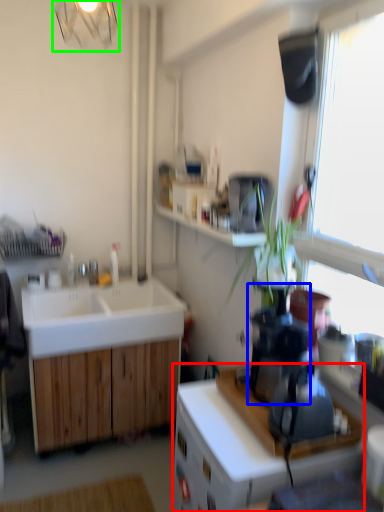
Question: Estimate the real-world distances between objects in this image. Which object is closer to cabinetry (highlighted by a red box), coffee machine (highlighted by a blue box) or light fixture (highlighted by a green box)?

Choices:
 (A) coffee machine
 (B) light fixture

Answer: (A)